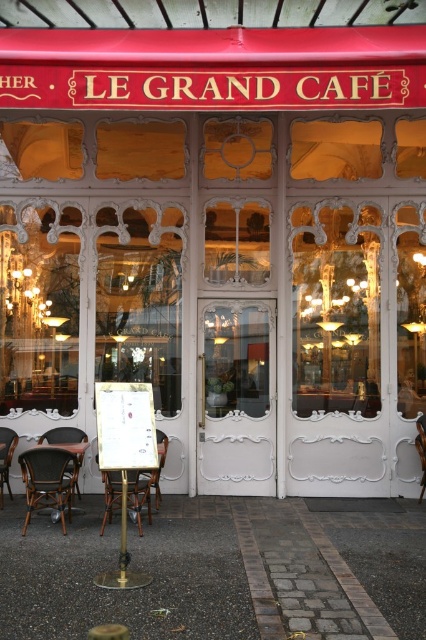
Question: Among these objects, which one is farthest from the camera?

Choices:
 (A) metallic gold chair at lower left
 (B) brown wicker chair at lower left

Answer: (B)

Question: Can you confirm if brown wicker chair at lower left is positioned above metallic gold chair at lower left?

Choices:
 (A) yes
 (B) no

Answer: (B)

Question: Does brown wicker chair at lower left have a smaller size compared to metallic gold chair at lower left?

Choices:
 (A) no
 (B) yes

Answer: (B)

Question: Which is nearer to the wooden chair at lower left?

Choices:
 (A) metallic gold chair at lower left
 (B) brown wicker chair at lower left
 (C) brown wooden table at lower left
 (D) wooden chair at center

Answer: (C)

Question: Which is farther from the brown woven chair at lower left?

Choices:
 (A) wooden chair at lower left
 (B) wooden chair at center
 (C) brown wicker chair at lower left
 (D) metallic gold chair at lower left

Answer: (D)

Question: Is wooden chair at lower left to the right of wooden chair at center from the viewer's perspective?

Choices:
 (A) no
 (B) yes

Answer: (A)